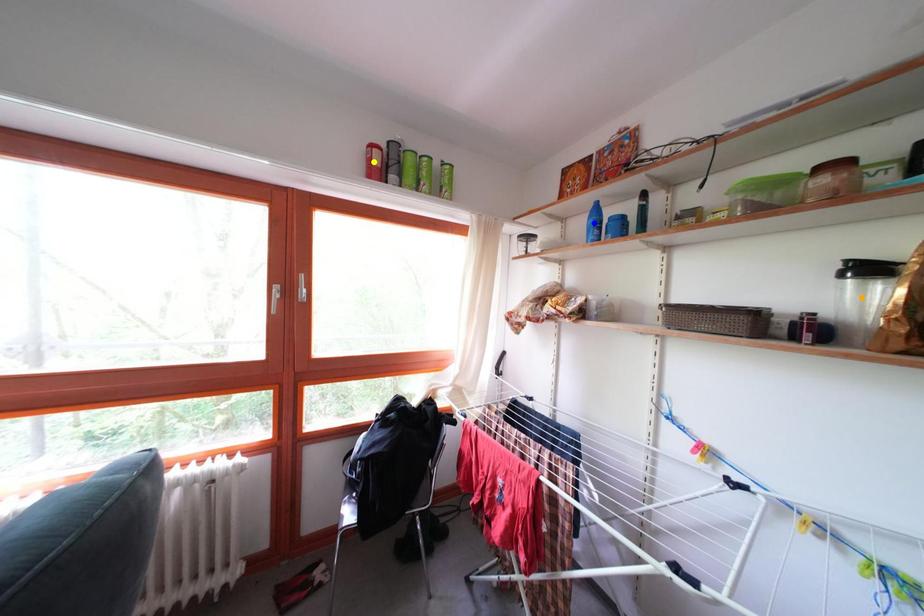
Order these from farthest to nearest:
orange point, yellow point, blue point

blue point → yellow point → orange point